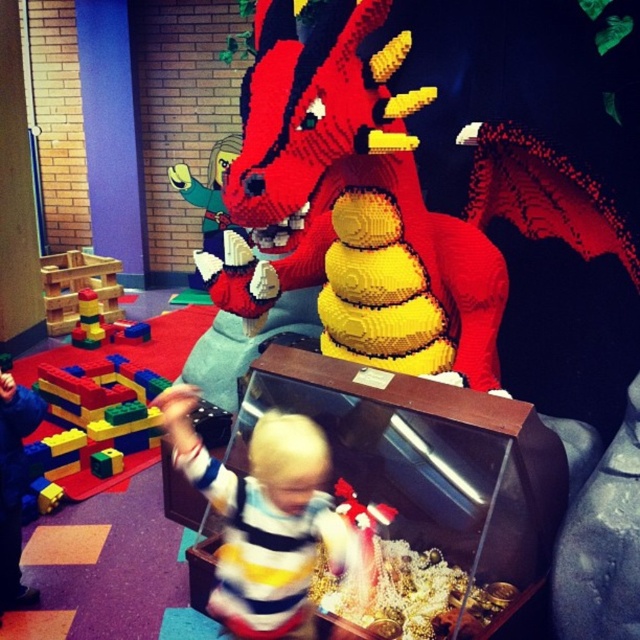
Question: Estimate the real-world distances between objects in this image. Which object is closer to the striped cotton shirt at center?

Choices:
 (A) wooden blocks at left
 (B) brick-like plastic blocks at left

Answer: (B)

Question: Can you confirm if striped cotton shirt at center is positioned above brick-like plastic blocks at left?

Choices:
 (A) yes
 (B) no

Answer: (B)

Question: Is striped cotton shirt at center bigger than brick-like plastic blocks at left?

Choices:
 (A) no
 (B) yes

Answer: (B)

Question: Which object appears farthest from the camera in this image?

Choices:
 (A) striped cotton shirt at center
 (B) brick-like plastic blocks at left

Answer: (B)

Question: Which point is farther from the camera taking this photo?

Choices:
 (A) (92, 300)
 (B) (163, 420)
 (C) (100, 316)

Answer: (C)

Question: Can you confirm if wooden blocks at left is thinner than brick-like plastic blocks at left?

Choices:
 (A) yes
 (B) no

Answer: (B)